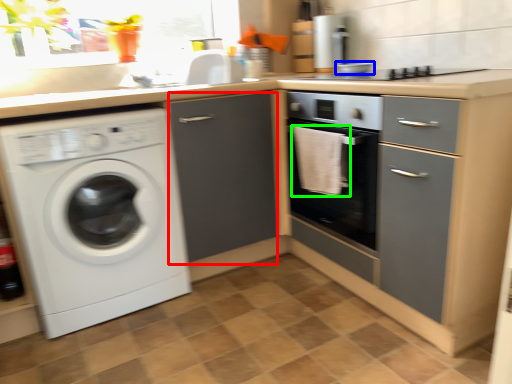
Question: Which object is positioned closest to file cabinet (highlighted by a red box)? Select from appliance (highlighted by a blue box) and material (highlighted by a green box).

Choices:
 (A) appliance
 (B) material

Answer: (B)